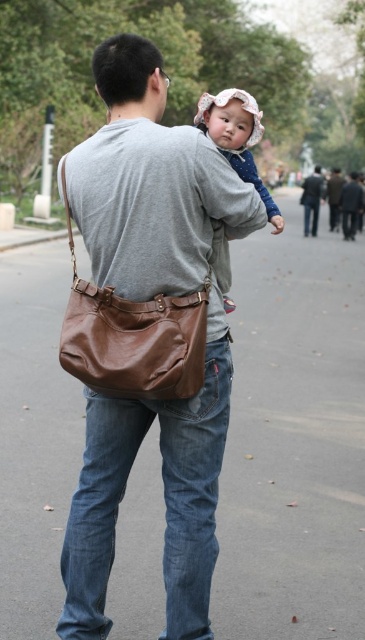
Is brown leather bag at center positioned at the back of matte pink hat at upper center?

No, brown leather bag at center is closer to the viewer.

Between brown leather bag at center and matte pink hat at upper center, which one is positioned lower?

Positioned lower is brown leather bag at center.

The image size is (365, 640). I want to click on brown leather bag at center, so click(147, 333).

Is brown leather bag at center above dark gray leather jacket at upper center?

No.

Describe the element at coordinates (147, 333) in the screenshot. This screenshot has width=365, height=640. I see `brown leather bag at center` at that location.

Find the location of a particular element. The image size is (365, 640). brown leather bag at center is located at coordinates (147, 333).

Which is in front, point (173, 358) or point (225, 154)?

Point (173, 358) is in front.

The width and height of the screenshot is (365, 640). Identify the location of brown leather messenger bag at left. coord(132,337).

Identify the location of brown leather messenger bag at left. The width and height of the screenshot is (365, 640). (132, 337).

What are the coordinates of `brown leather messenger bag at left` in the screenshot? It's located at (132, 337).